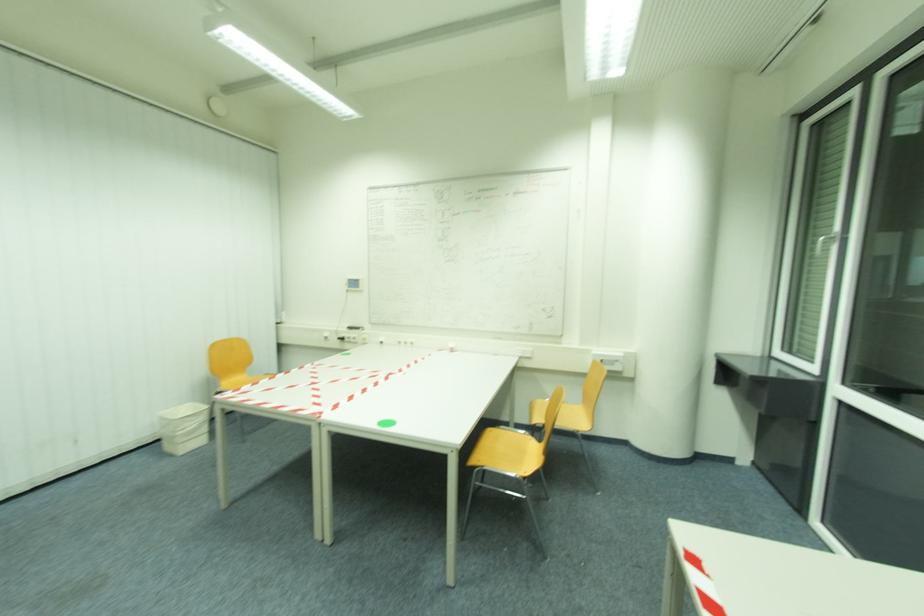
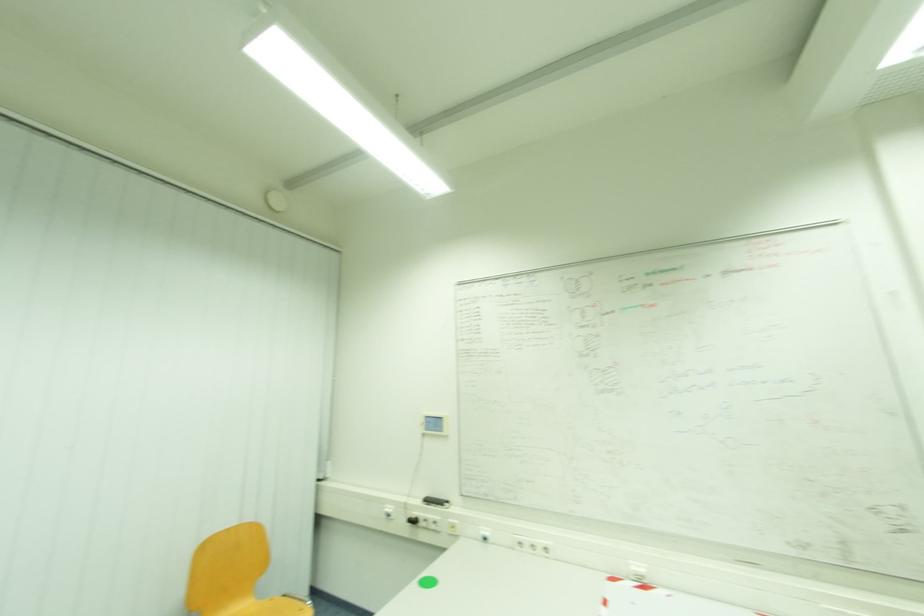
Which direction would the cameraman need to move to produce the second image?

The movement direction of the cameraman is left, forward.